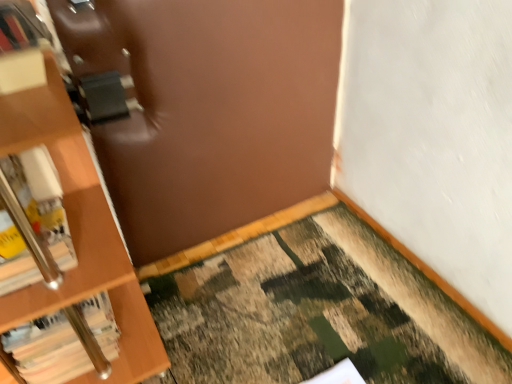
Question: Is camouflage carpet at lower right to the left or to the right of hardcover book at left, marked as the 2th book in a top-to-bottom arrangement, in the image?

Choices:
 (A) right
 (B) left

Answer: (A)

Question: Is camouflage carpet at lower right in front of or behind hardcover book at left, marked as the 2th book in a top-to-bottom arrangement, in the image?

Choices:
 (A) behind
 (B) front

Answer: (B)

Question: Which of these objects is positioned closest to the camouflage carpet at lower right?

Choices:
 (A) hardcover book at left, marked as the 2th book in a top-to-bottom arrangement
 (B) white matte book at left, placed as the 1th book when sorted from top to bottom

Answer: (A)

Question: Based on their relative distances, which object is farther from the white matte book at left, placed as the 2th book when sorted from bottom to top?

Choices:
 (A) hardcover book at left, marked as the 2th book in a top-to-bottom arrangement
 (B) camouflage carpet at lower right

Answer: (B)